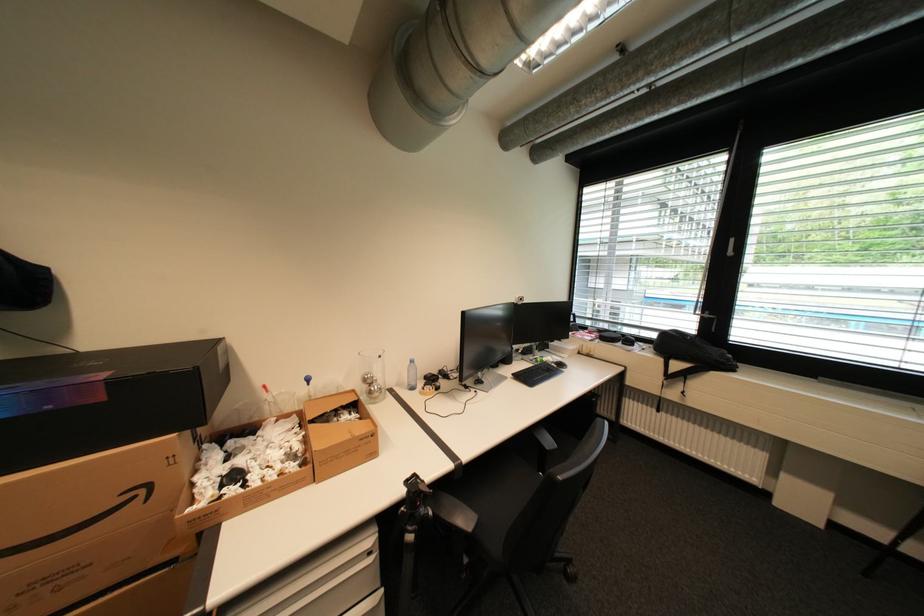
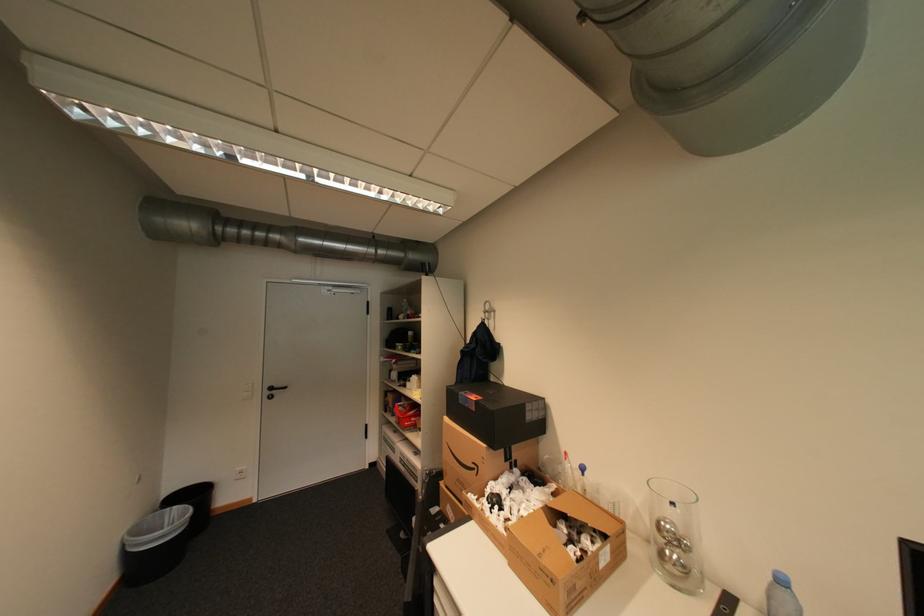
Find the pixel in the second image that matches [58,407] in the first image.

(476, 406)